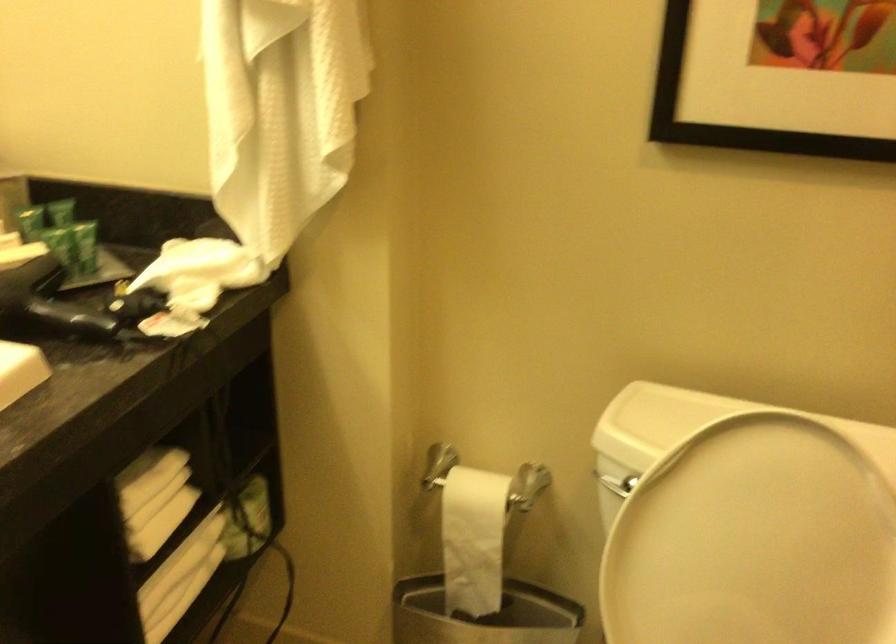
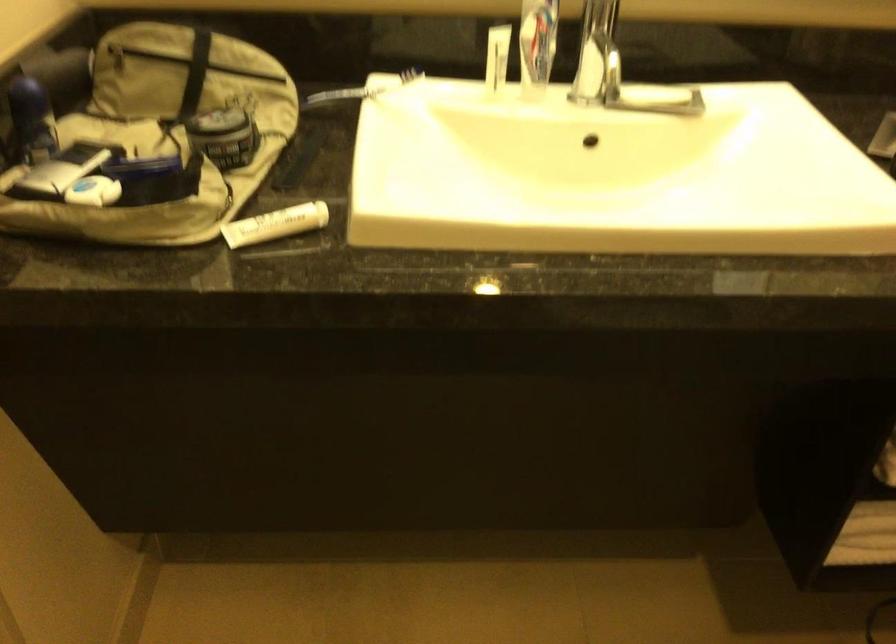
How did the camera likely rotate?

The camera's rotation is toward left-down.